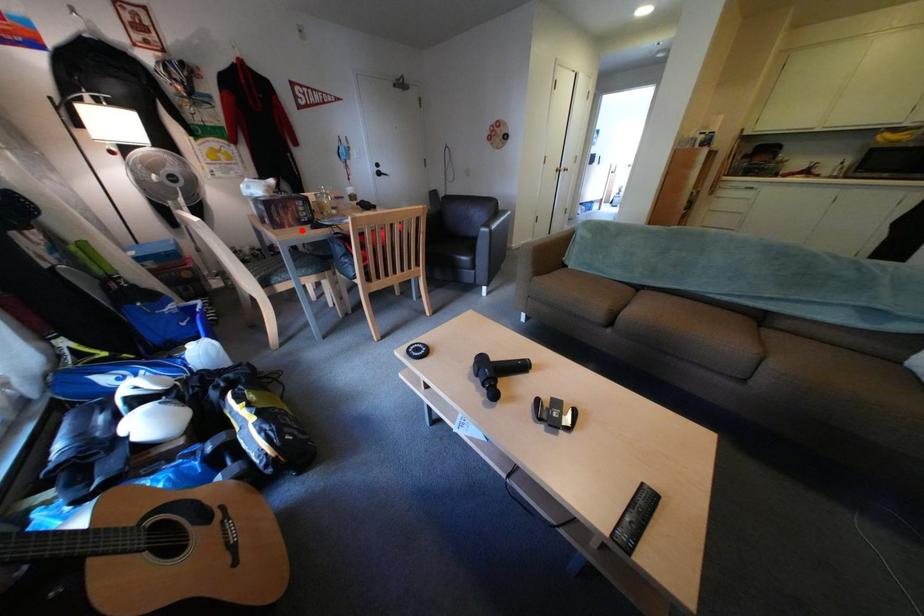
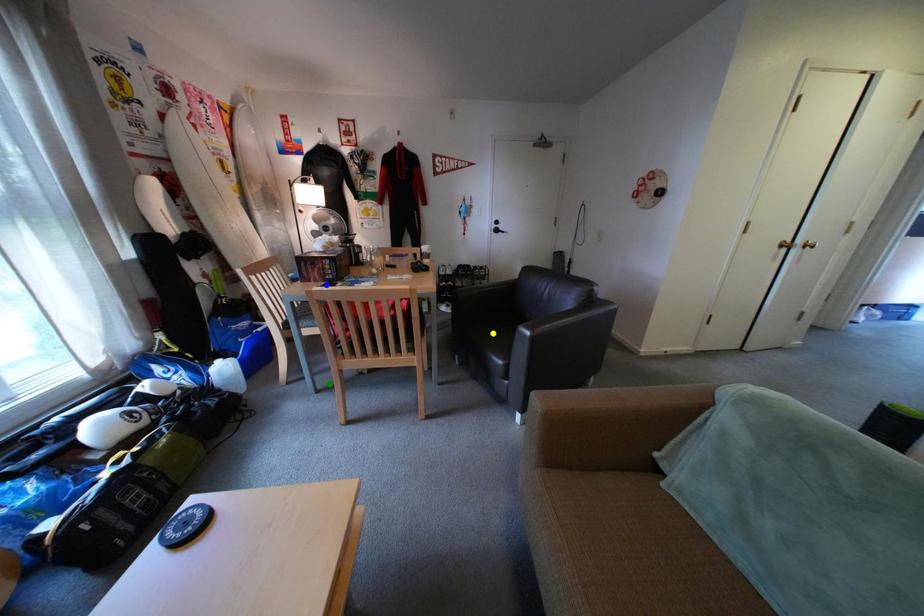
Question: I am providing you with two images of the same scene from different viewpoints. A red point is marked on the first image. You are given multiple points on the second image. Which spot in image 2 lines up with the point in image 1?

Choices:
 (A) blue point
 (B) green point
 (C) yellow point

Answer: (A)